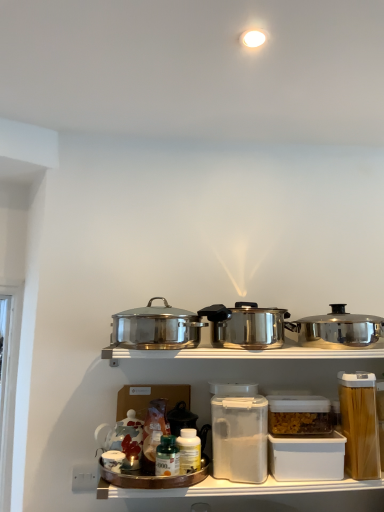
The height and width of the screenshot is (512, 384). Find the location of `free space to the left of white plastic container at lower center`. free space to the left of white plastic container at lower center is located at coordinates (246, 479).